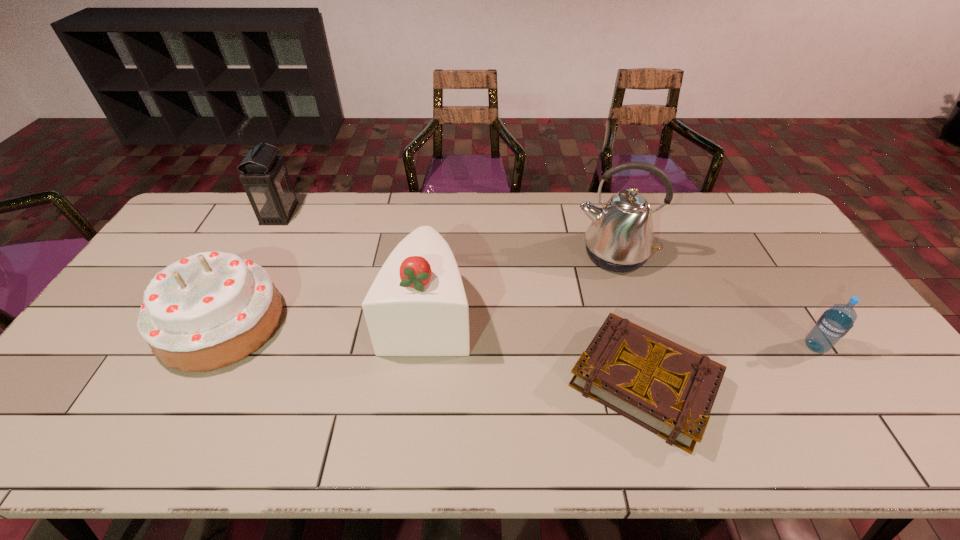
Find the location of `free location that satisfies the following two spatial constraints: 1. on the front-facing side of the farthest object; 2. on the left side of the shorter cake`. free location that satisfies the following two spatial constraints: 1. on the front-facing side of the farthest object; 2. on the left side of the shorter cake is located at coordinates (222, 323).

Where is `vacant space that satisfies the following two spatial constraints: 1. on the back side of the left cake; 2. on the left side of the kettle`? The width and height of the screenshot is (960, 540). vacant space that satisfies the following two spatial constraints: 1. on the back side of the left cake; 2. on the left side of the kettle is located at coordinates (258, 254).